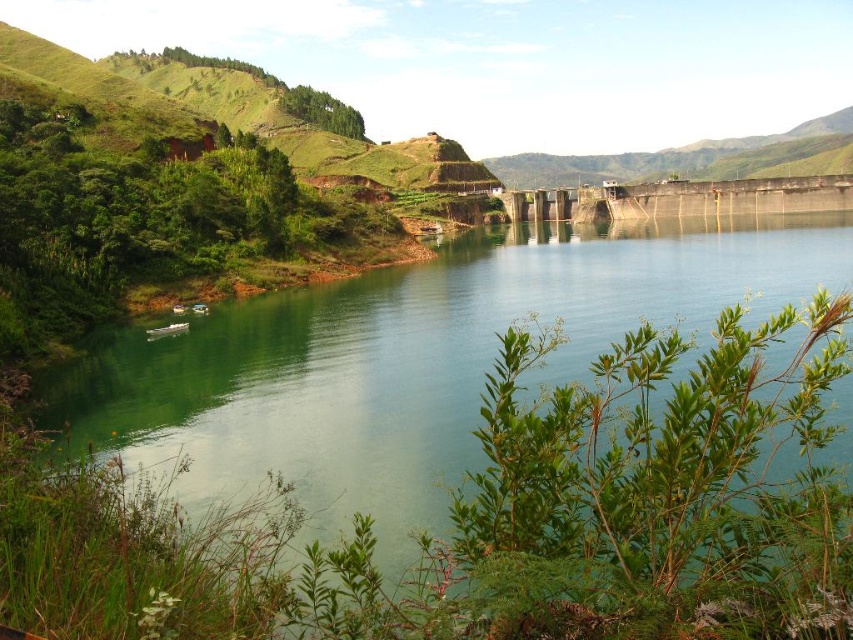
The image size is (853, 640). Describe the element at coordinates (466, 451) in the screenshot. I see `green smooth water at center` at that location.

Who is more forward, (259, 524) or (583, 525)?

Positioned in front is point (583, 525).

Between point (102, 428) and point (741, 408), which one is positioned behind?

The point (102, 428) is behind.

This screenshot has height=640, width=853. Find the location of `green smooth water at center`. green smooth water at center is located at coordinates [x=466, y=451].